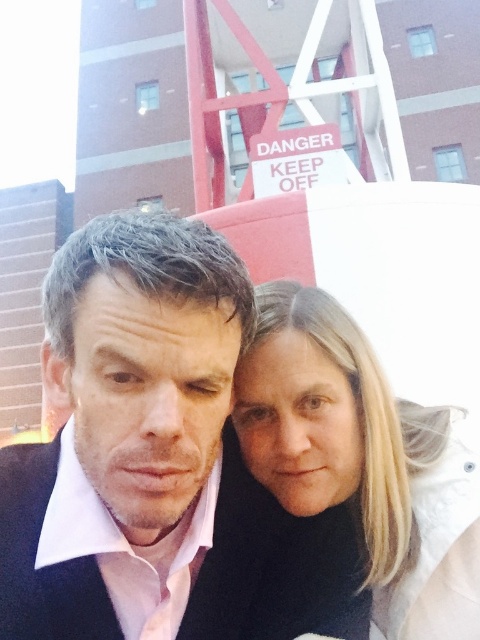
Question: In this image, where is pink matte shirt at center located relative to black matte business suit at center?

Choices:
 (A) above
 (B) below

Answer: (A)

Question: Where is blonde hair at center located in relation to black matte business suit at center in the image?

Choices:
 (A) above
 (B) below

Answer: (A)

Question: Which object is closer to the camera taking this photo?

Choices:
 (A) blonde hair at center
 (B) pink matte shirt at center
 (C) black matte business suit at center

Answer: (C)

Question: Does pink matte shirt at center have a smaller size compared to blonde hair at center?

Choices:
 (A) yes
 (B) no

Answer: (B)

Question: Which object appears closest to the camera in this image?

Choices:
 (A) blonde hair at center
 (B) black matte business suit at center

Answer: (B)

Question: Which of the following is the closest to the observer?

Choices:
 (A) (252, 602)
 (B) (91, 515)
 (C) (313, 340)

Answer: (B)